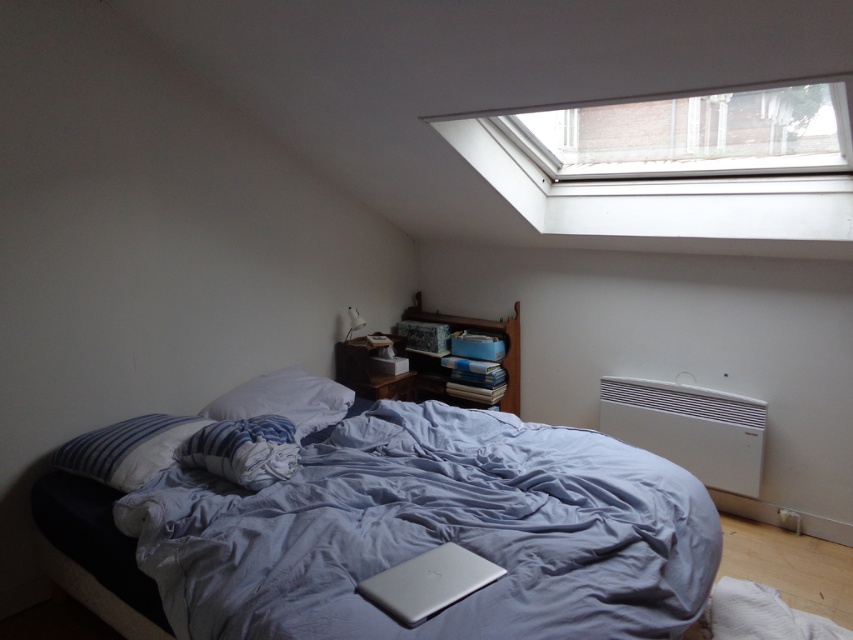
You are standing in the bedroom and want to open the transparent glass window at upper center to let in some fresh air. However, there is a white plastic radiator at lower right nearby. Which direction should you move towards to reach the window from the radiator?

The transparent glass window at upper center is located to the left of the white plastic radiator at lower right. Therefore, to reach the window from the radiator, you should move towards the left direction.